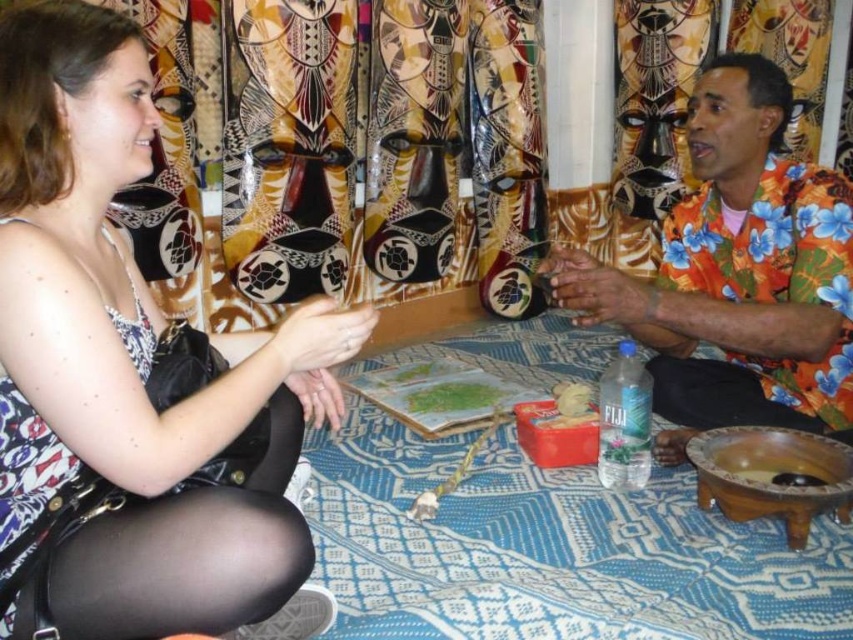
You are a photographer setting up for a photo shoot. You need to position a 1.2 meter wide backdrop behind the orange floral shirt at right and the green matte paper at center. Will the backdrop be wide enough to cover both objects?

The orange floral shirt at right might be wider than green matte paper at center. Since the total width required could be more than 1.2 meters if the shirt is wider, the backdrop may not be wide enough to cover both objects.

You are standing in front of the scene described. Which object is positioned to the left of the other between the matte black dress at left and the orange floral shirt at right?

The matte black dress at left is positioned to the left of the orange floral shirt at right.

You are an interior designer assessing the spatial arrangement of the scene. Considering the orange floral shirt at right and the green matte paper at center, which object occupies more visual space in the composition?

The orange floral shirt at right is bigger than the green matte paper at center, so it occupies more visual space in the composition.